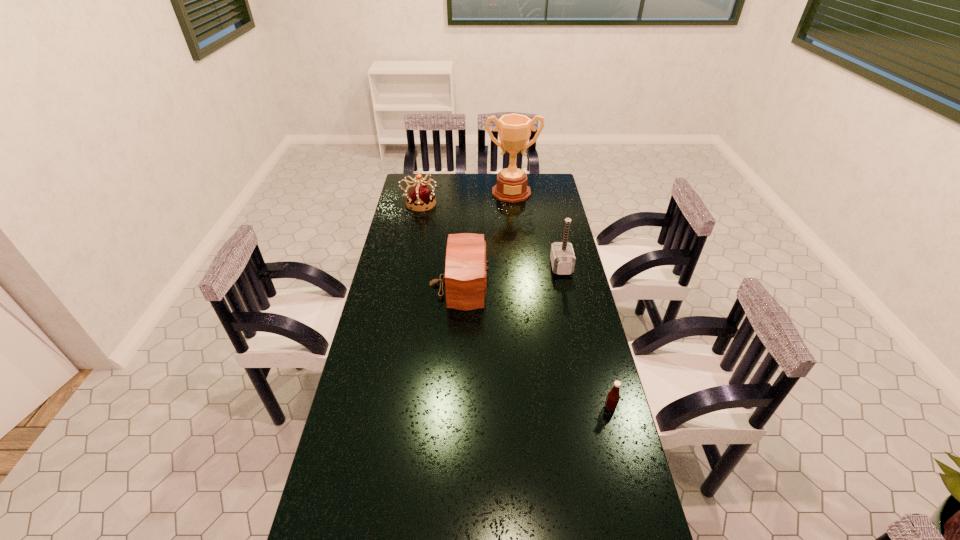
Where is `object that is at the far right corner`? object that is at the far right corner is located at coordinates (514, 130).

In the image, there is a desktop. At what (x,y) coordinates should I click in order to perform the action: click on free space at the far edge. Please return your answer as a coordinate pair (x, y). This screenshot has width=960, height=540. Looking at the image, I should click on (448, 174).

At what (x,y) coordinates should I click in order to perform the action: click on vacant space at the left edge. Please return your answer as a coordinate pair (x, y). Looking at the image, I should click on (411, 319).

The width and height of the screenshot is (960, 540). In order to click on blank area at the right edge in this screenshot , I will do `click(553, 211)`.

Where is `vacant region at the far right corner of the desktop`? This screenshot has height=540, width=960. vacant region at the far right corner of the desktop is located at coordinates [535, 179].

At what (x,y) coordinates should I click in order to perform the action: click on vacant space that is in between the fourth shortest object and the Tabasco sauce. Please return your answer as a coordinate pair (x, y). The height and width of the screenshot is (540, 960). Looking at the image, I should click on (586, 337).

Identify the location of vacant area that lies between the tiara and the radio receiver. (440, 244).

This screenshot has width=960, height=540. I want to click on vacant space in between the shortest object and the tallest object, so click(x=561, y=300).

Where is `free space between the nearest object and the tiara`? This screenshot has width=960, height=540. free space between the nearest object and the tiara is located at coordinates (515, 306).

Where is `free point between the second tallest object and the radio receiver`? free point between the second tallest object and the radio receiver is located at coordinates (511, 275).